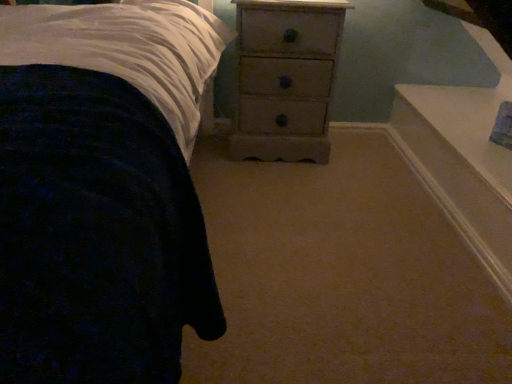
The image size is (512, 384). Describe the element at coordinates (285, 78) in the screenshot. I see `light brown wooden chest of drawers at center` at that location.

The width and height of the screenshot is (512, 384). I want to click on light brown wooden chest of drawers at center, so click(x=285, y=78).

From the picture: Measure the distance between point (236, 129) and camera.

Point (236, 129) is 1.85 meters away from camera.

At what (x,y) coordinates should I click in order to perform the action: click on light brown wooden chest of drawers at center. Please return your answer as a coordinate pair (x, y). Looking at the image, I should click on (285, 78).